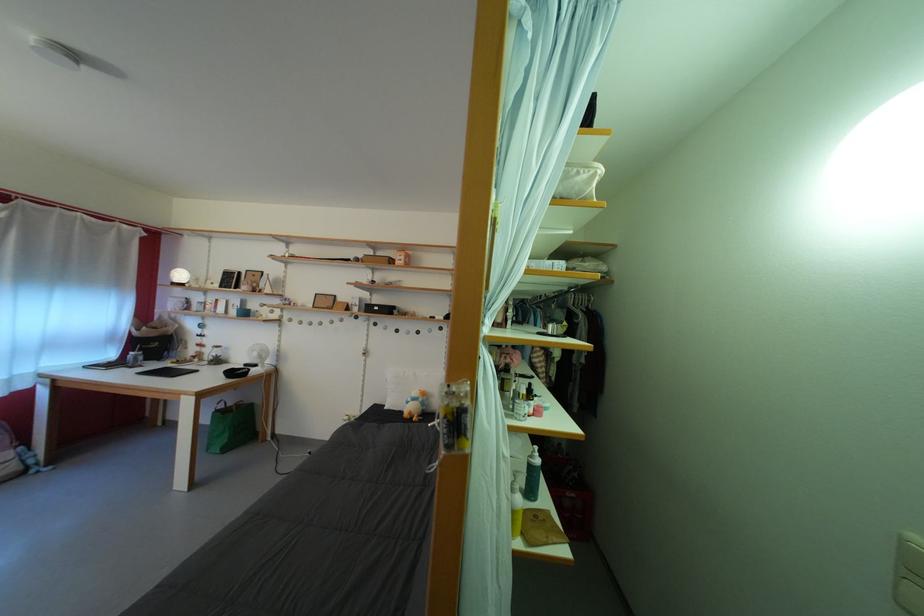
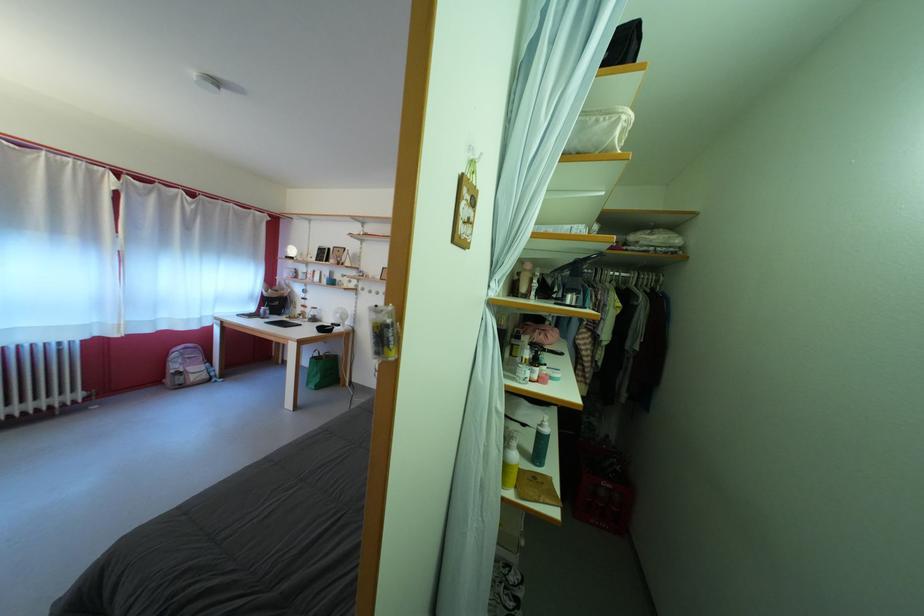
Find the pixel in the second image that matches pixel 587 179 in the first image.

(605, 128)